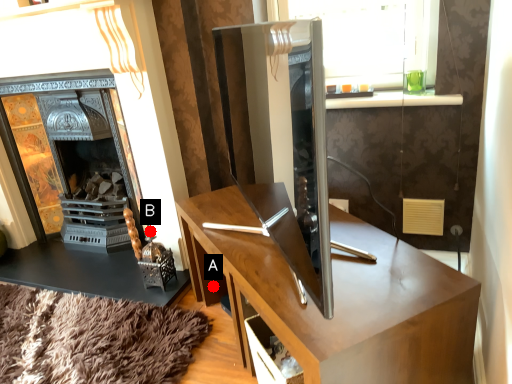
Question: Two points are circled on the image, labeled by A and B beside each circle. Which point appears closest to the camera in this image?

Choices:
 (A) A is closer
 (B) B is closer

Answer: (A)